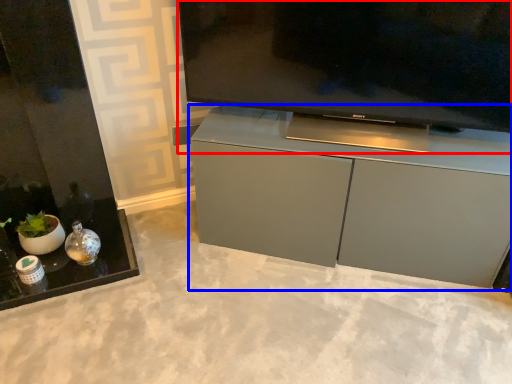
Question: Which object is closer to the camera taking this photo, television (highlighted by a red box) or cabinetry (highlighted by a blue box)?

Choices:
 (A) television
 (B) cabinetry

Answer: (A)